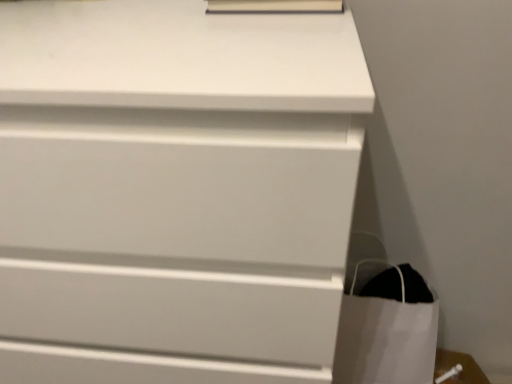
Question: Are white paper bag at lower right and matte white book at upper center far apart?

Choices:
 (A) no
 (B) yes

Answer: (A)

Question: Is white paper bag at lower right further to camera compared to matte white book at upper center?

Choices:
 (A) yes
 (B) no

Answer: (A)

Question: Is white paper bag at lower right bigger than matte white book at upper center?

Choices:
 (A) yes
 (B) no

Answer: (A)

Question: From a real-world perspective, is white paper bag at lower right physically below matte white book at upper center?

Choices:
 (A) yes
 (B) no

Answer: (A)

Question: Can you confirm if white paper bag at lower right is shorter than matte white book at upper center?

Choices:
 (A) yes
 (B) no

Answer: (B)

Question: Considering the relative sizes of white paper bag at lower right and matte white book at upper center in the image provided, is white paper bag at lower right smaller than matte white book at upper center?

Choices:
 (A) no
 (B) yes

Answer: (A)

Question: Is the position of white matte chest of drawers at center less distant than that of matte white book at upper center?

Choices:
 (A) yes
 (B) no

Answer: (A)

Question: Does white matte chest of drawers at center contain matte white book at upper center?

Choices:
 (A) no
 (B) yes

Answer: (A)

Question: From a real-world perspective, is white matte chest of drawers at center under matte white book at upper center?

Choices:
 (A) no
 (B) yes

Answer: (B)

Question: From a real-world perspective, is white matte chest of drawers at center physically above matte white book at upper center?

Choices:
 (A) yes
 (B) no

Answer: (B)

Question: Does white matte chest of drawers at center have a larger size compared to matte white book at upper center?

Choices:
 (A) no
 (B) yes

Answer: (B)

Question: Is white matte chest of drawers at center aimed at matte white book at upper center?

Choices:
 (A) no
 (B) yes

Answer: (A)

Question: From a real-world perspective, is matte white book at upper center physically above white matte chest of drawers at center?

Choices:
 (A) no
 (B) yes

Answer: (B)